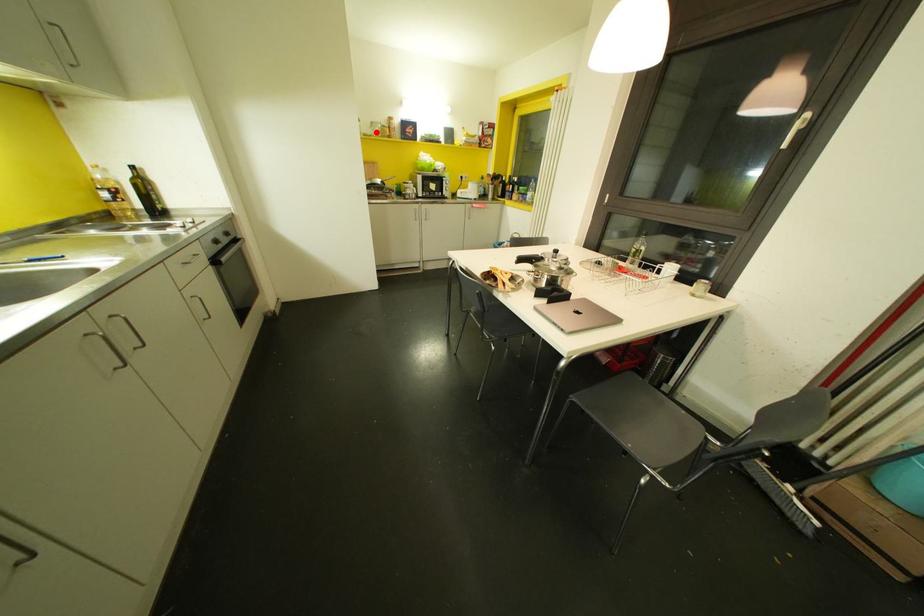
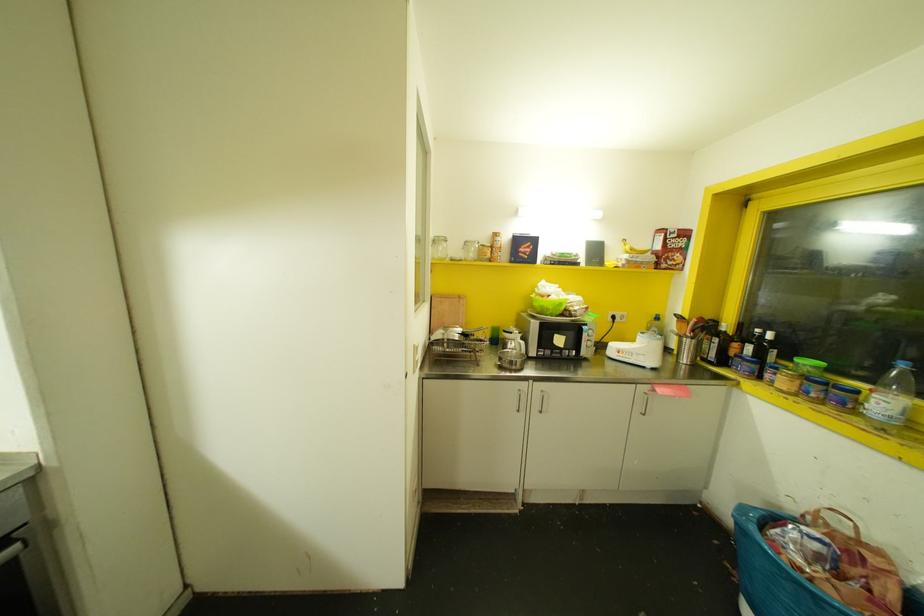
Question: I am providing you with two images of the same scene from different viewpoints. Given a red point in image1, look at the same physical point in image2. Is it:

Choices:
 (A) Closer to the viewpoint
 (B) Farther from the viewpoint

Answer: (B)